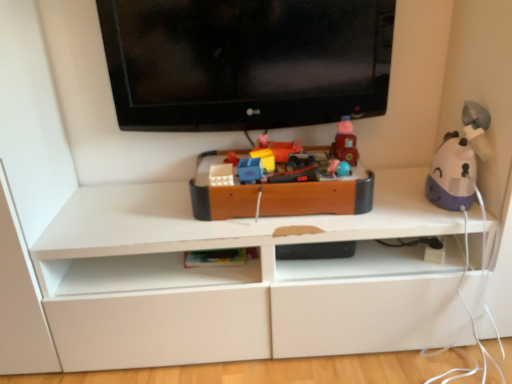
Identify the location of free space above wooden toy train at center, which appears as the 3th toy when viewed from the right (from a real-world perspective). (280, 165).